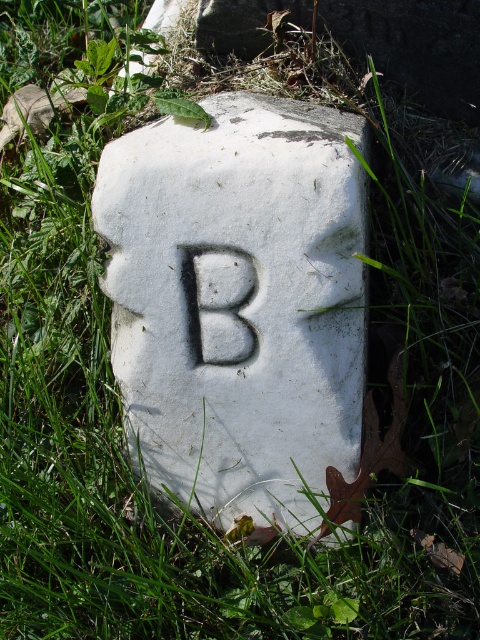
Does white stone at center appear over white stone letter b at center?

Actually, white stone at center is below white stone letter b at center.

How much distance is there between white stone at center and white stone letter b at center?

The distance of white stone at center from white stone letter b at center is 12.13 centimeters.

In order to click on white stone at center in this screenshot , I will do `click(239, 301)`.